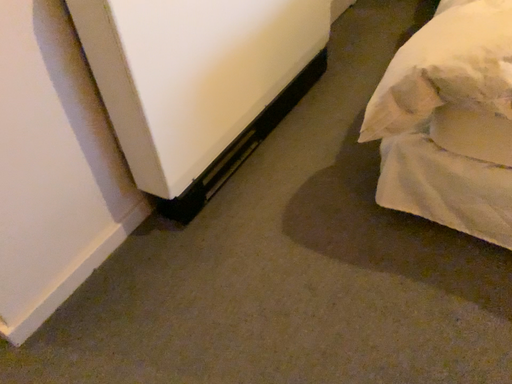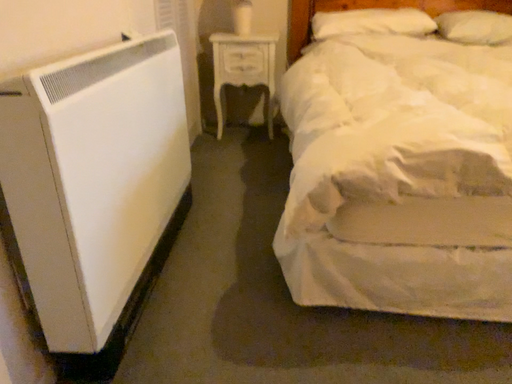
Question: Which way did the camera rotate in the video?

Choices:
 (A) rotated upward
 (B) rotated downward

Answer: (A)